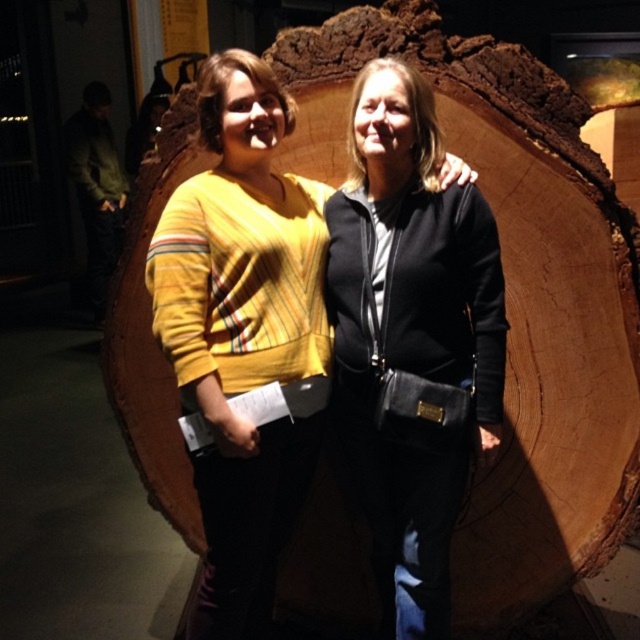
Does black leather jacket at center have a smaller size compared to matte yellow sweater at center?

Actually, black leather jacket at center might be larger than matte yellow sweater at center.

What do you see at coordinates (412, 339) in the screenshot? Image resolution: width=640 pixels, height=640 pixels. I see `black leather jacket at center` at bounding box center [412, 339].

Is point (458, 353) less distant than point (172, 220)?

No, (458, 353) is further to viewer.

Locate an element on the screen. black leather jacket at center is located at coordinates (412, 339).